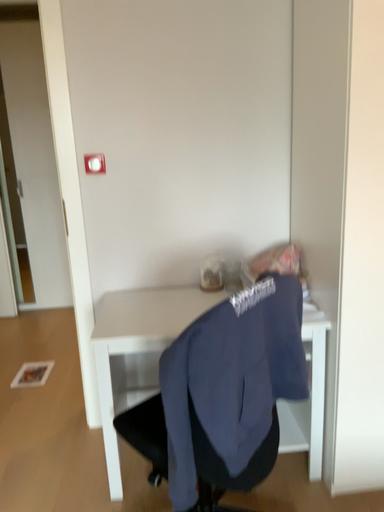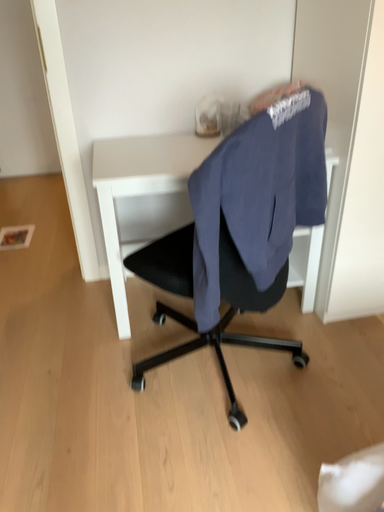
Question: Which way did the camera rotate in the video?

Choices:
 (A) rotated upward
 (B) rotated downward

Answer: (B)